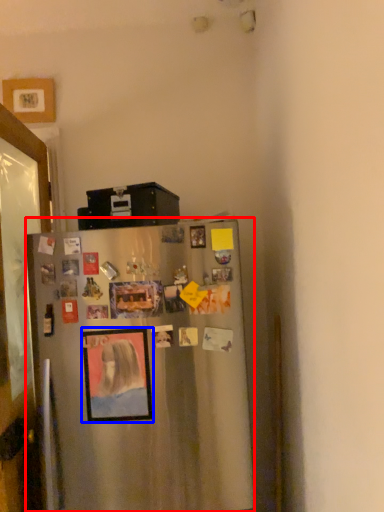
Question: Which point is further to the camera, refrigerator (highlighted by a red box) or picture frame (highlighted by a blue box)?

Choices:
 (A) refrigerator
 (B) picture frame

Answer: (B)